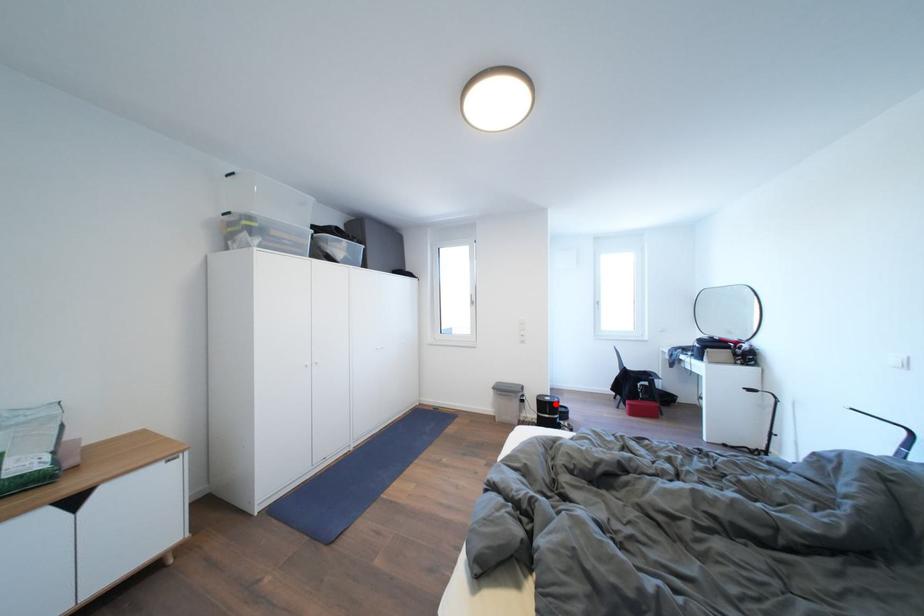
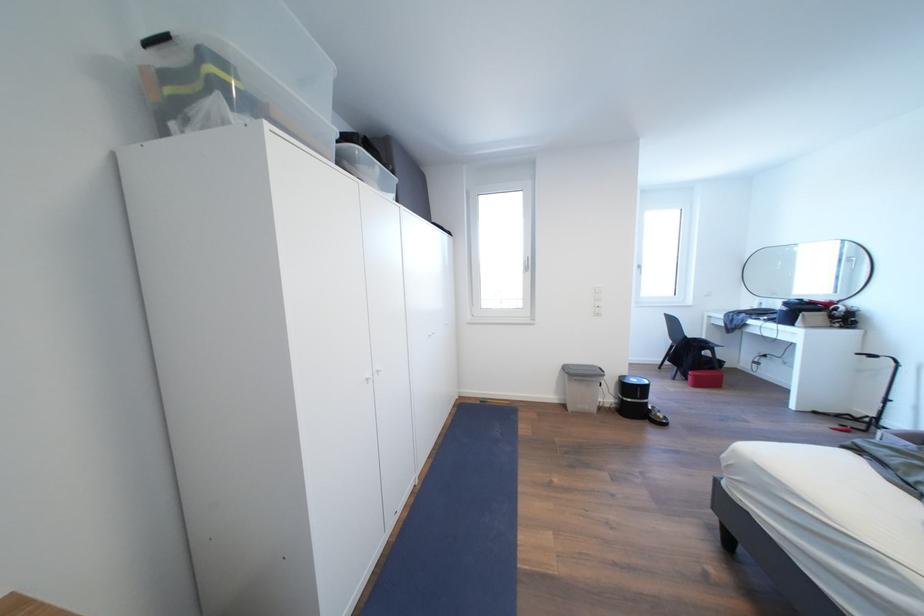
Question: I am providing you with two images of the same scene from different viewpoints. In image1, a red point is highlighted. Considering the same 3D point in image2, which of the following is correct?

Choices:
 (A) It is closer
 (B) It is farther

Answer: (B)